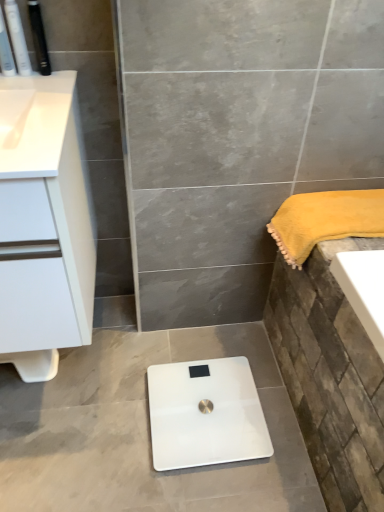
The image size is (384, 512). I want to click on space that is in front of white plastic toothbrushes at upper left, acting as the second toiletry starting from the right, so click(34, 93).